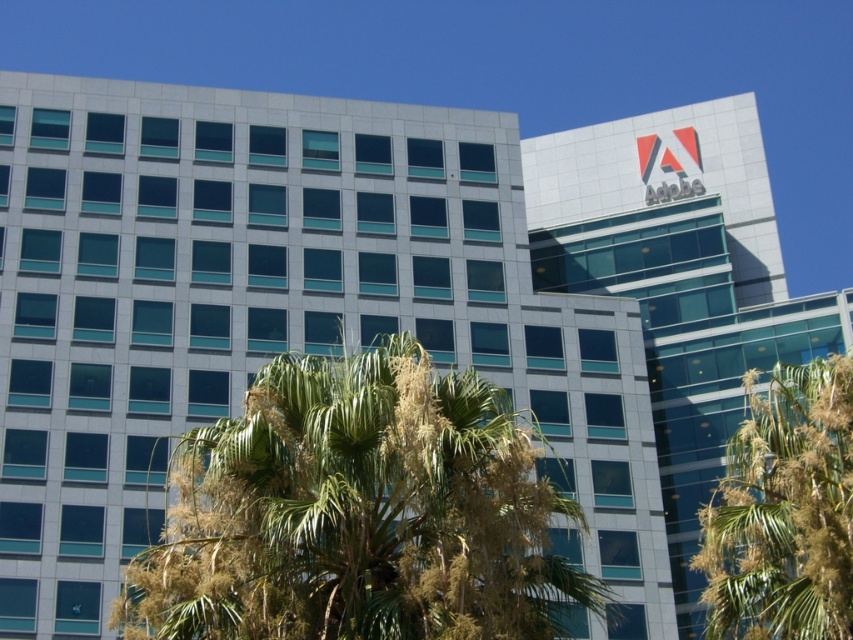
In the scene shown: Between green leafy palm tree at center and green leafy tree at lower right, which one has more height?

With more height is green leafy tree at lower right.

Is green leafy palm tree at center positioned in front of green leafy tree at lower right?

Yes, green leafy palm tree at center is in front of green leafy tree at lower right.

Describe the element at coordinates (358, 513) in the screenshot. I see `green leafy palm tree at center` at that location.

At what (x,y) coordinates should I click in order to perform the action: click on green leafy palm tree at center. Please return your answer as a coordinate pair (x, y). Looking at the image, I should click on (358, 513).